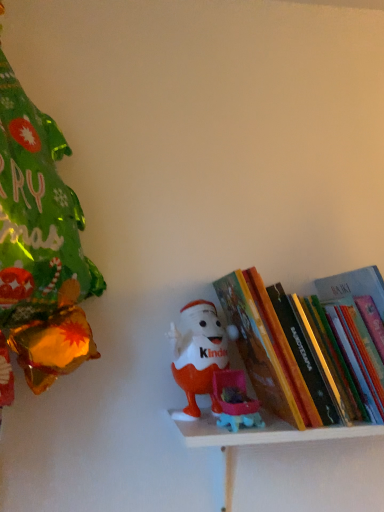
This screenshot has width=384, height=512. Find the location of `matte plastic toy at center`. matte plastic toy at center is located at coordinates (199, 354).

Identify the location of plastic toy at center. This screenshot has width=384, height=512. (253, 443).

This screenshot has height=512, width=384. What do you see at coordinates (294, 350) in the screenshot? I see `hardcover book at center` at bounding box center [294, 350].

At what (x,y) coordinates should I click in order to perform the action: click on matte plastic toy at center. Please return your answer as a coordinate pair (x, y). Looking at the image, I should click on (199, 354).

Is matte plastic toy at center to the left or to the right of plastic toy at center in the image?

In the image, matte plastic toy at center appears on the left side of plastic toy at center.

Is matte plastic toy at center oriented away from plastic toy at center?

No, matte plastic toy at center is not facing away from plastic toy at center.

Considering the sizes of objects matte plastic toy at center and plastic toy at center in the image provided, who is shorter, matte plastic toy at center or plastic toy at center?

plastic toy at center.

Is the depth of matte plastic toy at center greater than that of plastic toy at center?

Yes, the depth of matte plastic toy at center is greater than that of plastic toy at center.

From a real-world perspective, is hardcover book at center beneath plastic toy at center?

Actually, hardcover book at center is physically above plastic toy at center in the real world.

Which is in front, point (227, 298) or point (226, 472)?

The point (226, 472) is more forward.

Where is `book located on the right of plastic toy at center`? Image resolution: width=384 pixels, height=512 pixels. book located on the right of plastic toy at center is located at coordinates (294, 350).

Are hardcover book at center and plastic toy at center beside each other?

hardcover book at center and plastic toy at center are clearly separated.

Considering the relative positions of plastic toy at center and matte plastic toy at center in the image provided, is plastic toy at center to the left of matte plastic toy at center from the viewer's perspective?

No, plastic toy at center is not to the left of matte plastic toy at center.

Locate an element on the screen. shelf below the matte plastic toy at center (from the image's perspective) is located at coordinates (253, 443).

Considering the relative sizes of plastic toy at center and matte plastic toy at center in the image provided, is plastic toy at center shorter than matte plastic toy at center?

Yes.

I want to click on toy behind the hardcover book at center, so (x=199, y=354).

From the picture: Is matte plastic toy at center oriented towards hardcover book at center?

No, matte plastic toy at center does not turn towards hardcover book at center.

The width and height of the screenshot is (384, 512). In order to click on toy that is below the hardcover book at center (from the image's perspective) in this screenshot , I will do `click(199, 354)`.

Is hardcover book at center oriented away from matte plastic toy at center?

hardcover book at center is not turned away from matte plastic toy at center.

Is there a large distance between hardcover book at center and matte plastic toy at center?

No, hardcover book at center is in close proximity to matte plastic toy at center.

Considering the relative sizes of hardcover book at center and matte plastic toy at center in the image provided, is hardcover book at center thinner than matte plastic toy at center?

No.

Locate an element on the screen. The width and height of the screenshot is (384, 512). book behind the plastic toy at center is located at coordinates (x=294, y=350).

From a real-world perspective, is plastic toy at center positioned over hardcover book at center based on gravity?

No, from a real-world perspective, plastic toy at center is not on top of hardcover book at center.

Is plastic toy at center looking in the opposite direction of hardcover book at center?

No, hardcover book at center is not at the back of plastic toy at center.

Considering the positions of objects plastic toy at center and hardcover book at center in the image provided, who is in front, plastic toy at center or hardcover book at center?

plastic toy at center.

Identify the location of shelf to the right of matte plastic toy at center. Image resolution: width=384 pixels, height=512 pixels. (253, 443).

Identify the location of book above the plastic toy at center (from a real-world perspective). (294, 350).

From the image, which object appears to be farther from hardcover book at center, plastic toy at center or matte plastic toy at center?

Among the two, matte plastic toy at center is located further to hardcover book at center.

Estimate the real-world distances between objects in this image. Which object is further from plastic toy at center, matte plastic toy at center or hardcover book at center?

hardcover book at center.

Looking at the image, which one is located closer to hardcover book at center, matte plastic toy at center or plastic toy at center?

Based on the image, plastic toy at center appears to be nearer to hardcover book at center.

In the scene shown: When comparing their distances from matte plastic toy at center, does hardcover book at center or plastic toy at center seem further?

The object further to matte plastic toy at center is hardcover book at center.

Estimate the real-world distances between objects in this image. Which object is closer to matte plastic toy at center, plastic toy at center or hardcover book at center?

The object closer to matte plastic toy at center is plastic toy at center.

From the picture: When comparing their distances from plastic toy at center, does hardcover book at center or matte plastic toy at center seem further?

Based on the image, hardcover book at center appears to be further to plastic toy at center.

The image size is (384, 512). What are the coordinates of `toy that lies between hardcover book at center and plastic toy at center from top to bottom` in the screenshot? It's located at (199, 354).